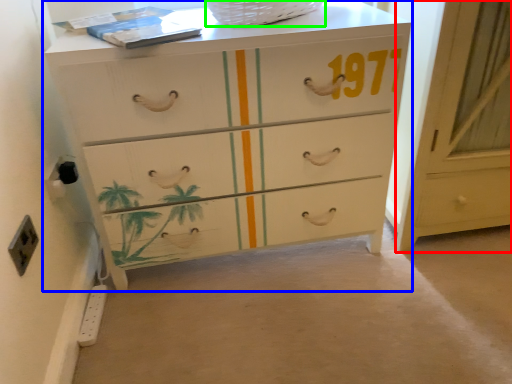
Question: Which object is positioned closest to cabinetry (highlighted by a red box)? Select from chest of drawers (highlighted by a blue box) and basket (highlighted by a green box).

Choices:
 (A) chest of drawers
 (B) basket

Answer: (A)